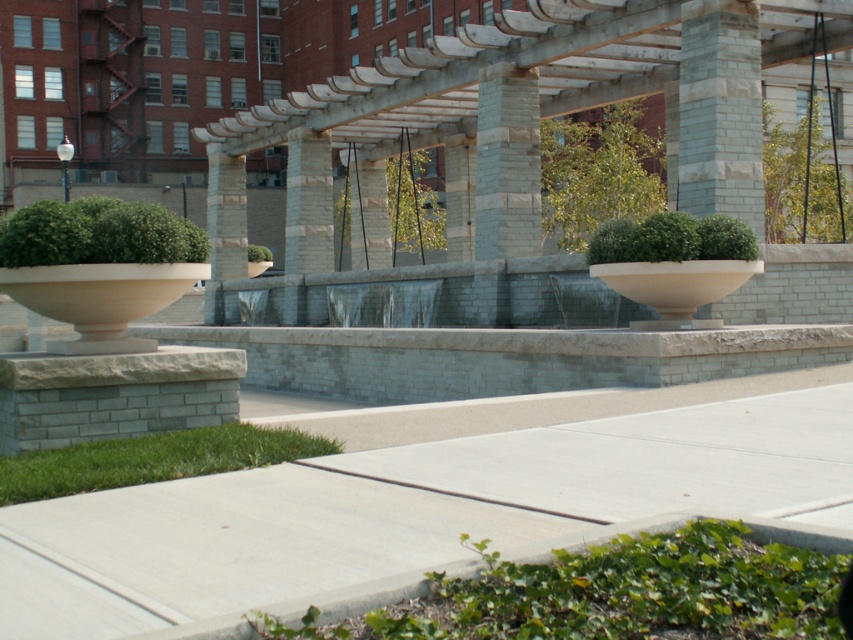
Question: Which of the following is the farthest from the observer?

Choices:
 (A) (537, 147)
 (B) (212, 269)

Answer: (B)

Question: Is concrete at center positioned at the back of gray stone pillar at center?

Choices:
 (A) no
 (B) yes

Answer: (A)

Question: Does gray stone column at center have a smaller size compared to gray stone pillar at center?

Choices:
 (A) yes
 (B) no

Answer: (A)

Question: Which of these objects is positioned farthest from the gray stone pillar at center?

Choices:
 (A) gray stone column at center
 (B) concrete at center
 (C) slate gray stone pillar at center

Answer: (B)

Question: Does gray stone column at center appear under gray stone pillar at center?

Choices:
 (A) yes
 (B) no

Answer: (A)

Question: Which of the following is the closest to the observer?

Choices:
 (A) gray stone column at center
 (B) slate gray stone pillar at center

Answer: (A)